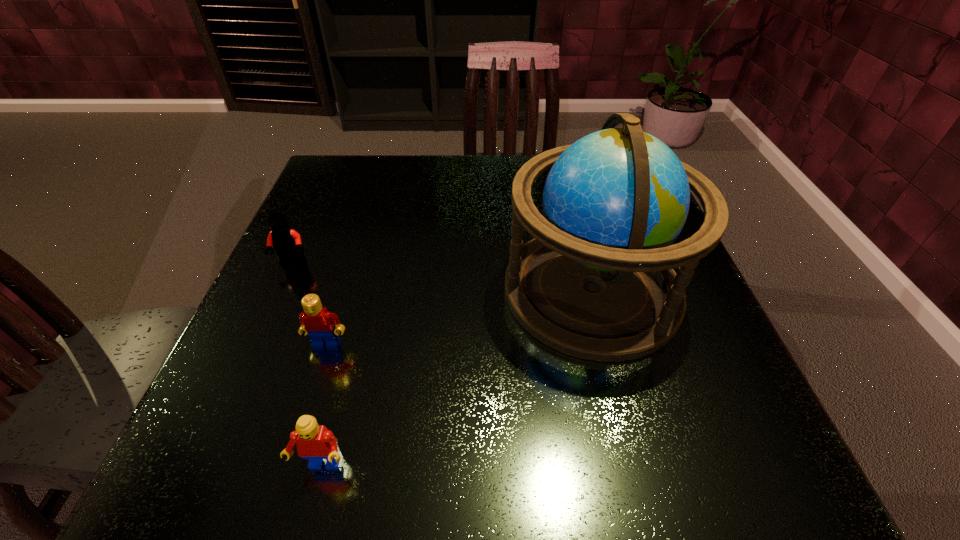
Find the location of a particular element. This screenshot has height=540, width=960. object at the right edge is located at coordinates (597, 282).

Locate an element on the screen. This screenshot has width=960, height=540. object positioned at the near left corner is located at coordinates (315, 442).

The image size is (960, 540). Identify the location of free space at the far edge of the desktop. [x=445, y=175].

Locate an element on the screen. free region at the near edge of the desktop is located at coordinates (379, 476).

At what (x,y) coordinates should I click in order to perform the action: click on vacant region at the left edge. Please return your answer as a coordinate pair (x, y). This screenshot has width=960, height=540. Looking at the image, I should click on (221, 396).

This screenshot has height=540, width=960. I want to click on vacant point at the near right corner, so click(715, 443).

The image size is (960, 540). I want to click on free space between the farthest Lego and the tallest object, so click(x=443, y=277).

Image resolution: width=960 pixels, height=540 pixels. I want to click on vacant space that's between the nearest object and the second farthest Lego, so click(x=324, y=406).

You are a GUI agent. You are given a task and a screenshot of the screen. Output one action in this format:
    pyautogui.click(x=<x>, y=<y>)
    Task: Click on the blank region between the second farthest Lego and the nearest Lego
    This screenshot has width=960, height=540.
    Given the screenshot: What is the action you would take?
    pyautogui.click(x=324, y=406)

Locate an element on the screen. blank region between the nearest object and the tallest object is located at coordinates (457, 379).